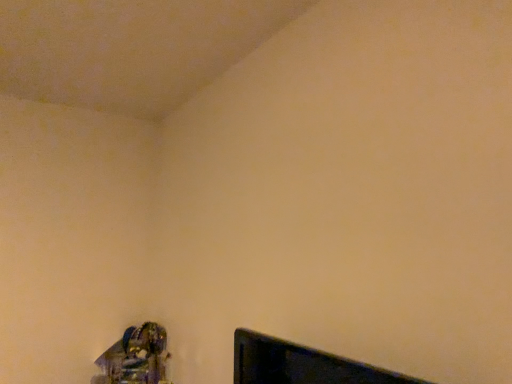
What do you see at coordinates (301, 364) in the screenshot?
I see `black glossy television at lower right` at bounding box center [301, 364].

Where is `black glossy television at lower right`? Image resolution: width=512 pixels, height=384 pixels. black glossy television at lower right is located at coordinates (301, 364).

This screenshot has width=512, height=384. What are the coordinates of `black glossy television at lower right` in the screenshot? It's located at (301, 364).